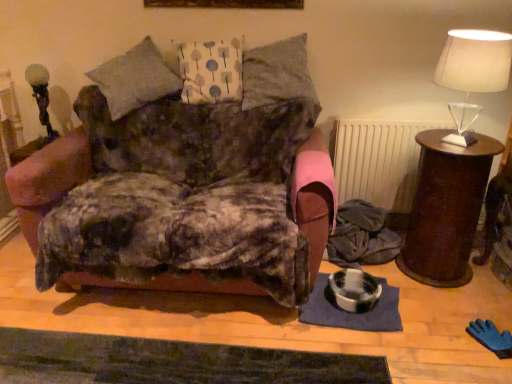
Question: Is translucent glass table lamp at upper right, which ranks as the first table lamp in front-to-back order, thinner than white textured radiator at center?

Choices:
 (A) yes
 (B) no

Answer: (B)

Question: From a real-world perspective, is translucent glass table lamp at upper right, which is the first table lamp in right-to-left order, over white textured radiator at center?

Choices:
 (A) yes
 (B) no

Answer: (A)

Question: Is translucent glass table lamp at upper right, which ranks as the first table lamp in front-to-back order, oriented away from white textured radiator at center?

Choices:
 (A) yes
 (B) no

Answer: (B)

Question: Can you confirm if translucent glass table lamp at upper right, which is the first table lamp in right-to-left order, is positioned to the right of white textured radiator at center?

Choices:
 (A) yes
 (B) no

Answer: (A)

Question: Can you see translucent glass table lamp at upper right, which is the first table lamp in right-to-left order, touching white textured radiator at center?

Choices:
 (A) yes
 (B) no

Answer: (B)

Question: Is brown wooden side table at right taller or shorter than white fabric pillow at center, marked as the first pillow in a left-to-right arrangement?

Choices:
 (A) short
 (B) tall

Answer: (B)

Question: Would you say brown wooden side table at right is to the left or to the right of white fabric pillow at center, marked as the first pillow in a left-to-right arrangement, in the picture?

Choices:
 (A) left
 (B) right

Answer: (B)

Question: Relative to white fabric pillow at center, arranged as the second pillow when viewed from the right, is brown wooden side table at right in front or behind?

Choices:
 (A) behind
 (B) front

Answer: (B)

Question: Looking at their shapes, would you say brown wooden side table at right is wider or thinner than white fabric pillow at center, arranged as the second pillow when viewed from the right?

Choices:
 (A) wide
 (B) thin

Answer: (A)

Question: From the image's perspective, is white textured radiator at center positioned above or below matte glass table lamp at left, the second table lamp viewed from the front?

Choices:
 (A) below
 (B) above

Answer: (A)

Question: From a real-world perspective, relative to matte glass table lamp at left, arranged as the 1th table lamp when viewed from the back, is white textured radiator at center vertically above or below?

Choices:
 (A) below
 (B) above

Answer: (A)

Question: Is point (359, 162) closer or farther from the camera than point (44, 107)?

Choices:
 (A) closer
 (B) farther

Answer: (A)

Question: Based on their positions, is white textured radiator at center located to the left or right of matte glass table lamp at left, the 1th table lamp in the left-to-right sequence?

Choices:
 (A) right
 (B) left

Answer: (A)

Question: In terms of width, does translucent glass table lamp at upper right, which is the 2th table lamp in left-to-right order, look wider or thinner when compared to white fabric pillow at center, marked as the first pillow in a left-to-right arrangement?

Choices:
 (A) thin
 (B) wide

Answer: (A)

Question: Is point (451, 87) positioned closer to the camera than point (220, 56)?

Choices:
 (A) farther
 (B) closer

Answer: (B)